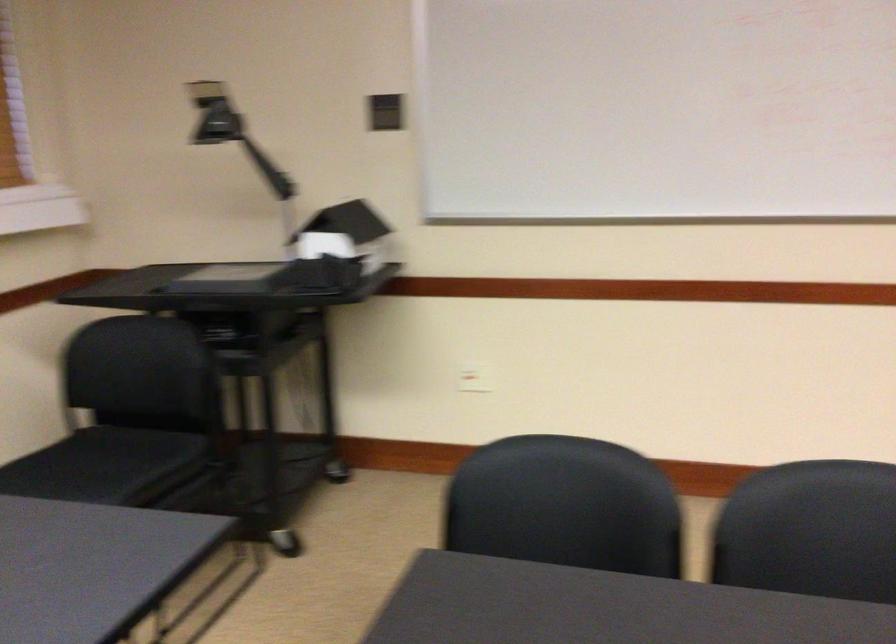
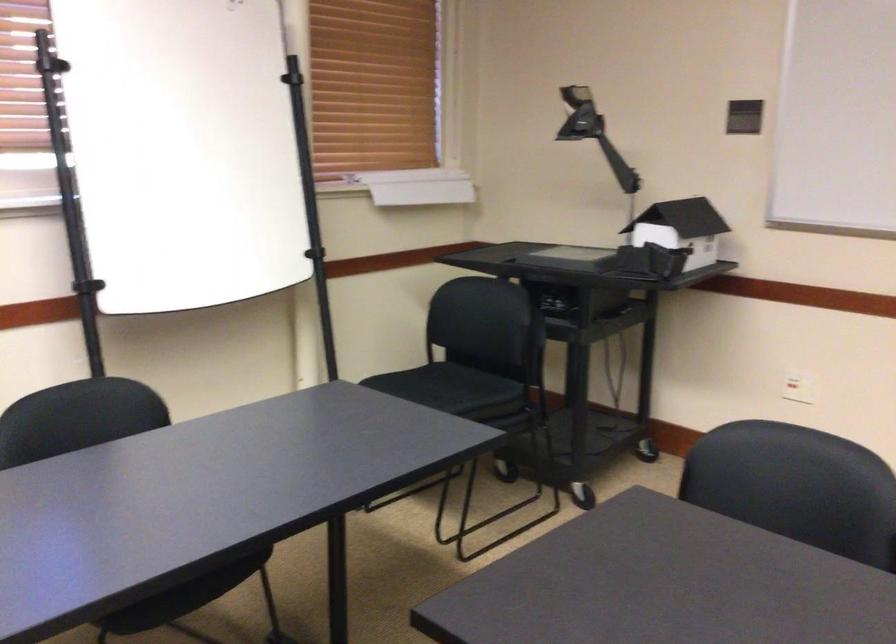
Where in the second image is the point corresponding to pixel 362 237 from the first image?

(681, 229)